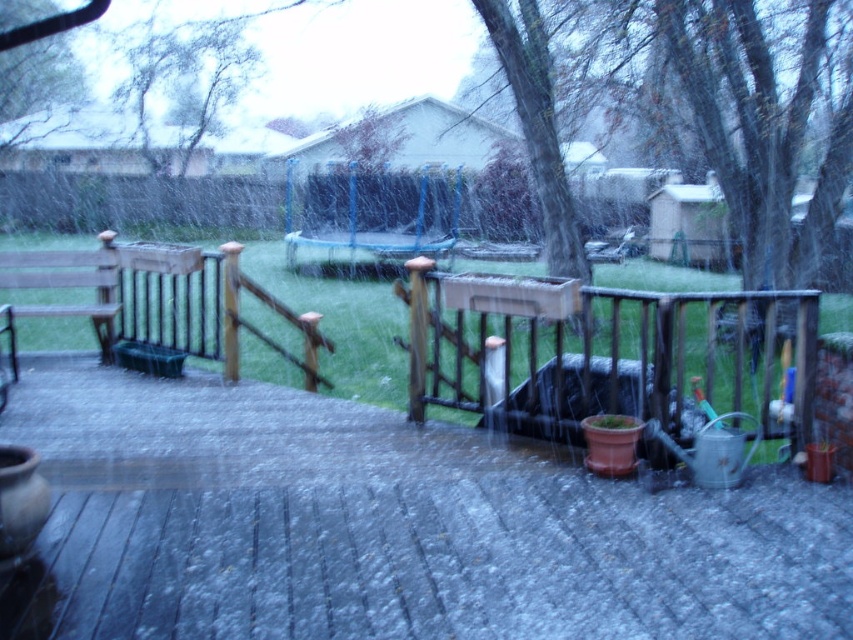
Who is higher up, wooden bench at left or wooden at right?

wooden bench at left is higher up.

Is wooden bench at left wider than wooden at right?

Indeed, wooden bench at left has a greater width compared to wooden at right.

Describe the element at coordinates (596, 355) in the screenshot. I see `wooden bench at left` at that location.

What are the coordinates of `wooden bench at left` in the screenshot? It's located at (596, 355).

Is smooth wooden deck at center smaller than wooden at right?

Actually, smooth wooden deck at center might be larger than wooden at right.

Can you confirm if smooth wooden deck at center is shorter than wooden at right?

Correct, smooth wooden deck at center is not as tall as wooden at right.

Who is more forward, (363,524) or (590,305)?

Point (363,524) is more forward.

Find the location of a particular element. This screenshot has height=640, width=853. smooth wooden deck at center is located at coordinates (387, 528).

Between point (212, 396) and point (809, 324), which one is positioned in front?

Point (809, 324) is in front.

The image size is (853, 640). Describe the element at coordinates (387, 528) in the screenshot. I see `smooth wooden deck at center` at that location.

This screenshot has width=853, height=640. I want to click on smooth wooden deck at center, so click(x=387, y=528).